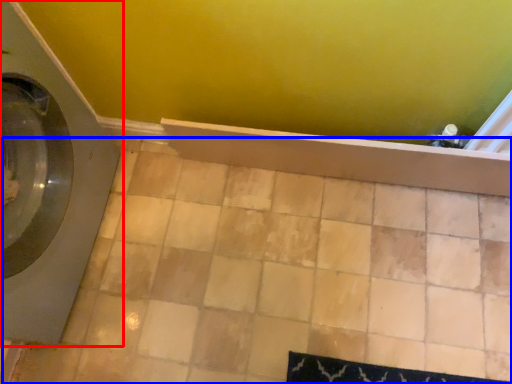
Question: Which of the following is the farthest to the observer, washing machine (highlighted by a red box) or ceramic tile (highlighted by a blue box)?

Choices:
 (A) washing machine
 (B) ceramic tile

Answer: (B)